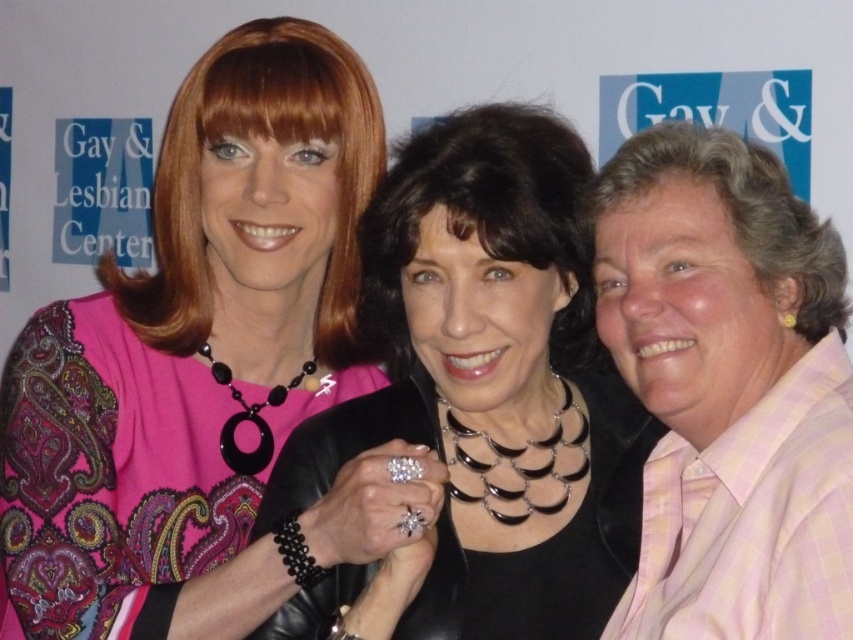
Question: Which is farther from the pink checkered shirt at right?

Choices:
 (A) matte pink blouse at upper left
 (B) black leather jacket at center

Answer: (A)

Question: Does black leather jacket at center appear on the right side of pink checkered shirt at right?

Choices:
 (A) yes
 (B) no

Answer: (B)

Question: Which is farther from the pink checkered shirt at right?

Choices:
 (A) black leather jacket at center
 (B) matte pink blouse at upper left

Answer: (B)

Question: Is black leather jacket at center thinner than pink checkered shirt at right?

Choices:
 (A) no
 (B) yes

Answer: (A)

Question: Can you confirm if black leather jacket at center is positioned to the left of pink checkered shirt at right?

Choices:
 (A) yes
 (B) no

Answer: (A)

Question: Which object is closer to the camera taking this photo?

Choices:
 (A) black leather jacket at center
 (B) pink checkered shirt at right

Answer: (B)